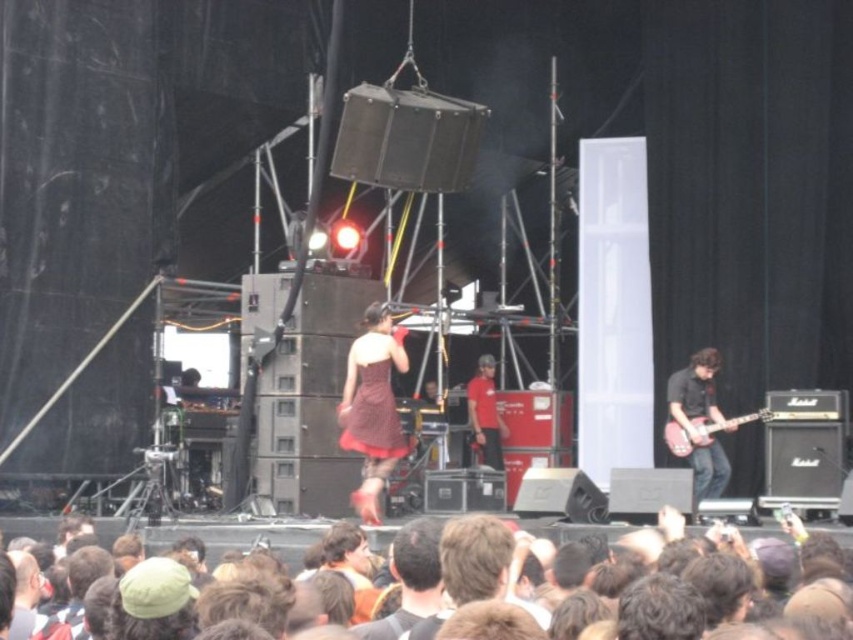
Question: Does red smooth shirt at center appear on the right side of pink glossy electric guitar at right?

Choices:
 (A) yes
 (B) no

Answer: (B)

Question: Which point is farther to the camera?

Choices:
 (A) matte red dress at center
 (B) burgundy satin dress at center

Answer: (A)

Question: Which point is closer to the camera?

Choices:
 (A) (491, 460)
 (B) (679, 442)
 (C) (700, 410)
 (D) (390, 632)

Answer: (D)

Question: Does burgundy satin dress at center appear on the right side of red smooth shirt at center?

Choices:
 (A) no
 (B) yes

Answer: (A)

Question: Is matte red dress at center to the left of brown hair at lower center from the viewer's perspective?

Choices:
 (A) yes
 (B) no

Answer: (A)

Question: Estimate the real-world distances between objects in this image. Which object is closer to the pink glossy electric guitar at right?

Choices:
 (A) brown hair at lower center
 (B) shiny black guitar at right
 (C) burgundy satin dress at center

Answer: (B)